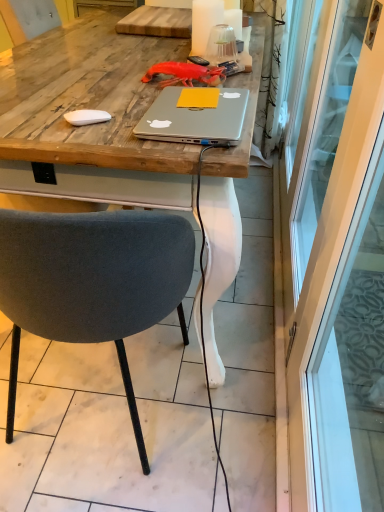
Question: In terms of height, does transparent glass screen door at right look taller or shorter compared to velvet grey chair at center?

Choices:
 (A) tall
 (B) short

Answer: (A)

Question: Considering the positions of point (314, 190) and point (84, 242), is point (314, 190) closer or farther from the camera than point (84, 242)?

Choices:
 (A) farther
 (B) closer

Answer: (A)

Question: Which is nearer to the velvet grey chair at center?

Choices:
 (A) wooden desk at center
 (B) transparent glass screen door at right
 (C) silver metallic laptop at center

Answer: (C)

Question: Based on their relative distances, which object is farther from the wooden desk at center?

Choices:
 (A) silver metallic laptop at center
 (B) velvet grey chair at center
 (C) transparent glass screen door at right

Answer: (C)